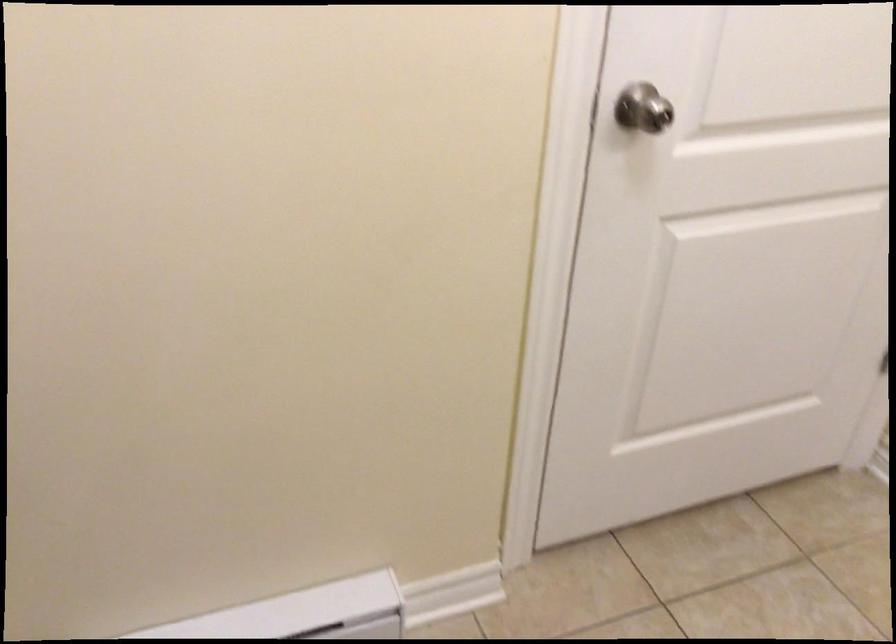
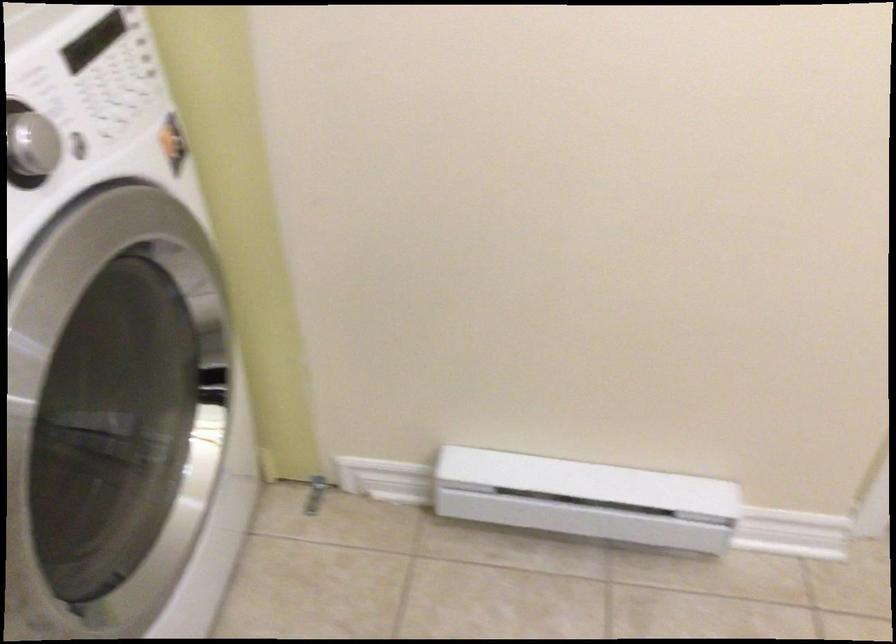
Question: The camera is either moving clockwise (left) or counter-clockwise (right) around the object. The first image is from the beginning of the video and the second image is from the end. Is the camera moving left or right when shooting the video?

Choices:
 (A) Left
 (B) Right

Answer: (B)